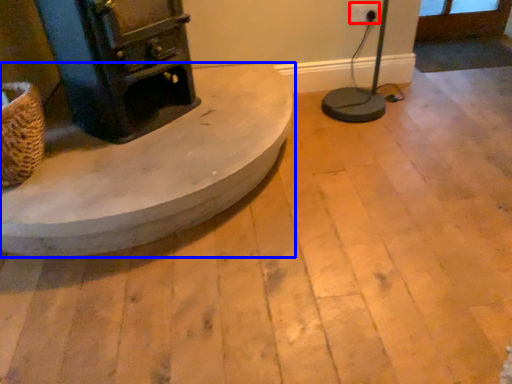
Question: Which point is closer to the camera, electric outlet (highlighted by a red box) or furniture (highlighted by a blue box)?

Choices:
 (A) electric outlet
 (B) furniture

Answer: (B)